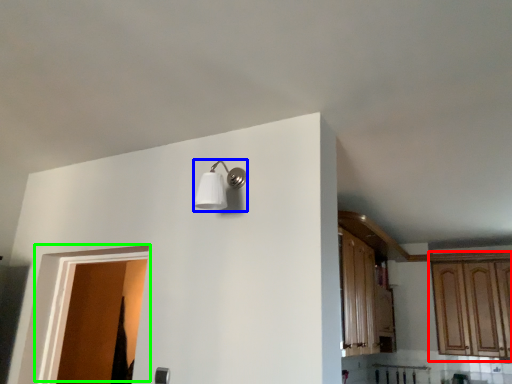
Question: Which is farther away from cabinetry (highlighted by a red box)? light fixture (highlighted by a blue box) or door (highlighted by a green box)?

Choices:
 (A) light fixture
 (B) door

Answer: (B)